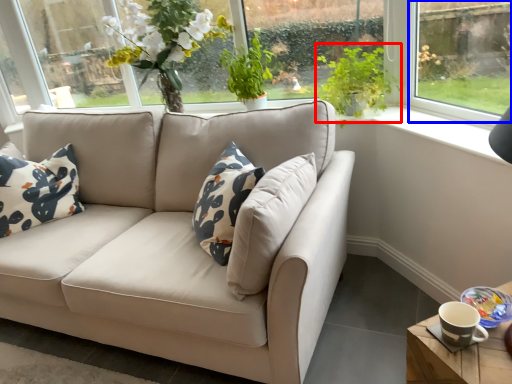
Question: Which object appears farthest to the camera in this image, plant (highlighted by a red box) or window (highlighted by a blue box)?

Choices:
 (A) plant
 (B) window

Answer: (A)